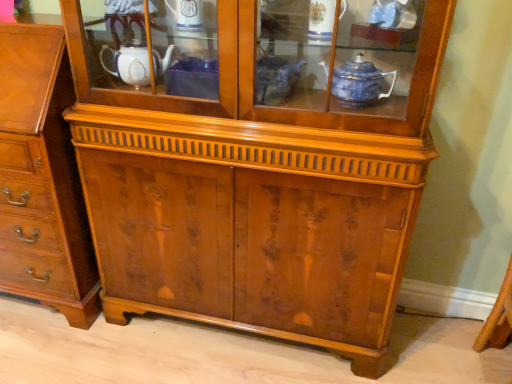
Describe the element at coordinates (42, 178) in the screenshot. The width and height of the screenshot is (512, 384). I see `matte wood chest of drawers at left` at that location.

This screenshot has width=512, height=384. I want to click on matte wood chest of drawers at left, so click(x=42, y=178).

Find the location of a particular element. matte wood chest of drawers at left is located at coordinates (42, 178).